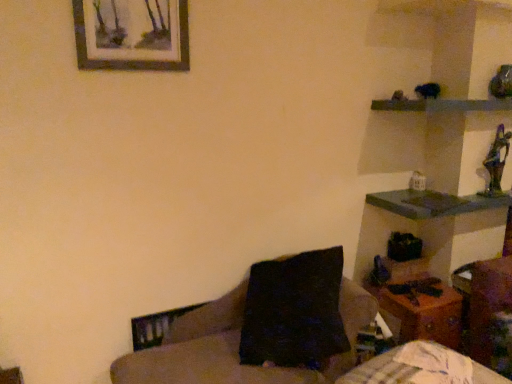
Question: Is wooden shelf at upper right positioned beyond the bounds of dark brown fabric couch at center?

Choices:
 (A) no
 (B) yes

Answer: (B)

Question: Can you confirm if wooden shelf at upper right is shorter than dark brown fabric couch at center?

Choices:
 (A) yes
 (B) no

Answer: (A)

Question: Considering the relative positions of wooden shelf at upper right and dark brown fabric couch at center in the image provided, is wooden shelf at upper right to the left of dark brown fabric couch at center from the viewer's perspective?

Choices:
 (A) yes
 (B) no

Answer: (B)

Question: Could you tell me if wooden shelf at upper right is turned towards dark brown fabric couch at center?

Choices:
 (A) yes
 (B) no

Answer: (B)

Question: Is wooden shelf at upper right behind dark brown fabric couch at center?

Choices:
 (A) yes
 (B) no

Answer: (A)

Question: From the image's perspective, is wooden table at lower right located above or below dark brown fabric couch at center?

Choices:
 (A) above
 (B) below

Answer: (A)

Question: Is wooden table at lower right in front of or behind dark brown fabric couch at center in the image?

Choices:
 (A) front
 (B) behind

Answer: (B)

Question: Considering the positions of point (412, 319) and point (233, 369), is point (412, 319) closer or farther from the camera than point (233, 369)?

Choices:
 (A) farther
 (B) closer

Answer: (A)

Question: Is wooden table at lower right bigger or smaller than dark brown fabric couch at center?

Choices:
 (A) big
 (B) small

Answer: (B)

Question: Considering the positions of point (167, 31) and point (411, 324), is point (167, 31) closer or farther from the camera than point (411, 324)?

Choices:
 (A) farther
 (B) closer

Answer: (B)

Question: Considering their positions, is wooden picture frame at upper left located in front of or behind wooden table at lower right?

Choices:
 (A) front
 (B) behind

Answer: (A)

Question: Considering the positions of wooden picture frame at upper left and wooden table at lower right in the image, is wooden picture frame at upper left taller or shorter than wooden table at lower right?

Choices:
 (A) short
 (B) tall

Answer: (A)

Question: From a real-world perspective, is wooden picture frame at upper left physically located above or below wooden table at lower right?

Choices:
 (A) above
 (B) below

Answer: (A)

Question: Is wooden shelf at upper right in front of or behind dark brown fabric couch at center in the image?

Choices:
 (A) front
 (B) behind

Answer: (B)

Question: Is wooden shelf at upper right to the left or to the right of dark brown fabric couch at center in the image?

Choices:
 (A) right
 (B) left

Answer: (A)